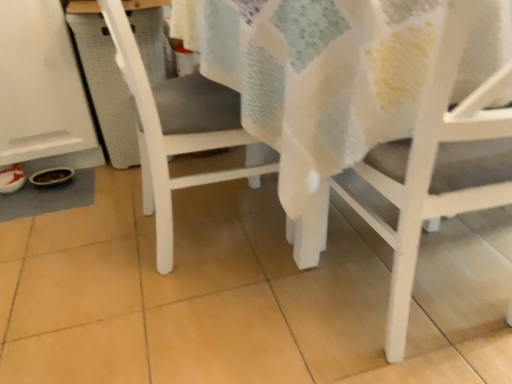
Question: Does white matte chair at center, arranged as the second chair when viewed from the right, come in front of white matte chair at lower right, arranged as the second chair when viewed from the left?

Choices:
 (A) yes
 (B) no

Answer: (B)

Question: From a real-world perspective, does white matte chair at center, which ranks as the 1th chair in left-to-right order, sit lower than white matte chair at lower right, the 1th chair viewed from the right?

Choices:
 (A) yes
 (B) no

Answer: (A)

Question: Is white matte chair at center, which ranks as the 1th chair in left-to-right order, with white matte chair at lower right, arranged as the second chair when viewed from the left?

Choices:
 (A) yes
 (B) no

Answer: (B)

Question: From the image's perspective, is white matte chair at center, which ranks as the 1th chair in left-to-right order, on top of white matte chair at lower right, the 1th chair viewed from the right?

Choices:
 (A) no
 (B) yes

Answer: (B)

Question: Considering the relative sizes of white matte chair at center, arranged as the second chair when viewed from the right, and white matte chair at lower right, arranged as the second chair when viewed from the left, in the image provided, is white matte chair at center, arranged as the second chair when viewed from the right, smaller than white matte chair at lower right, arranged as the second chair when viewed from the left,?

Choices:
 (A) yes
 (B) no

Answer: (B)

Question: Is the position of white matte chair at center, which ranks as the 1th chair in left-to-right order, more distant than that of white matte chair at lower right, arranged as the second chair when viewed from the left?

Choices:
 (A) yes
 (B) no

Answer: (A)

Question: Is white matte chair at lower right, the 1th chair viewed from the right, shorter than white matte chair at center, which ranks as the 1th chair in left-to-right order?

Choices:
 (A) yes
 (B) no

Answer: (B)

Question: Considering the relative positions of white matte chair at lower right, the 1th chair viewed from the right, and white matte chair at center, which ranks as the 1th chair in left-to-right order, in the image provided, is white matte chair at lower right, the 1th chair viewed from the right, to the left of white matte chair at center, which ranks as the 1th chair in left-to-right order, from the viewer's perspective?

Choices:
 (A) no
 (B) yes

Answer: (A)

Question: Can you confirm if white matte chair at lower right, the 1th chair viewed from the right, is taller than white matte chair at center, arranged as the second chair when viewed from the right?

Choices:
 (A) yes
 (B) no

Answer: (A)

Question: Is white matte chair at center, arranged as the second chair when viewed from the right, located within white matte chair at lower right, arranged as the second chair when viewed from the left?

Choices:
 (A) yes
 (B) no

Answer: (B)

Question: Could you tell me if white matte chair at lower right, arranged as the second chair when viewed from the left, is facing white matte chair at center, which ranks as the 1th chair in left-to-right order?

Choices:
 (A) no
 (B) yes

Answer: (A)

Question: Considering the relative sizes of white matte chair at lower right, arranged as the second chair when viewed from the left, and white matte chair at center, arranged as the second chair when viewed from the right, in the image provided, is white matte chair at lower right, arranged as the second chair when viewed from the left, thinner than white matte chair at center, arranged as the second chair when viewed from the right,?

Choices:
 (A) no
 (B) yes

Answer: (B)

Question: From their relative heights in the image, would you say white matte chair at lower right, the 1th chair viewed from the right, is taller or shorter than white matte chair at center, arranged as the second chair when viewed from the right?

Choices:
 (A) tall
 (B) short

Answer: (A)